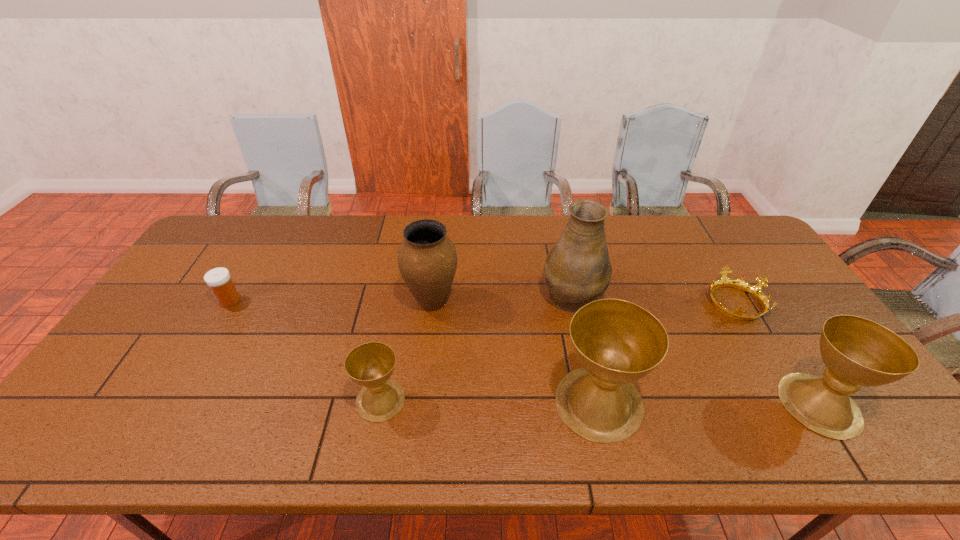
All chalices are currently evenly spaced. To continue this pattern, where would you add another chalice on the left? Please point out a vacant spot. Please provide its 2D coordinates. Your answer should be formatted as a tuple, i.e. [(x, y)], where the tuple contains the x and y coordinates of a point satisfying the conditions above.

[(164, 397)]